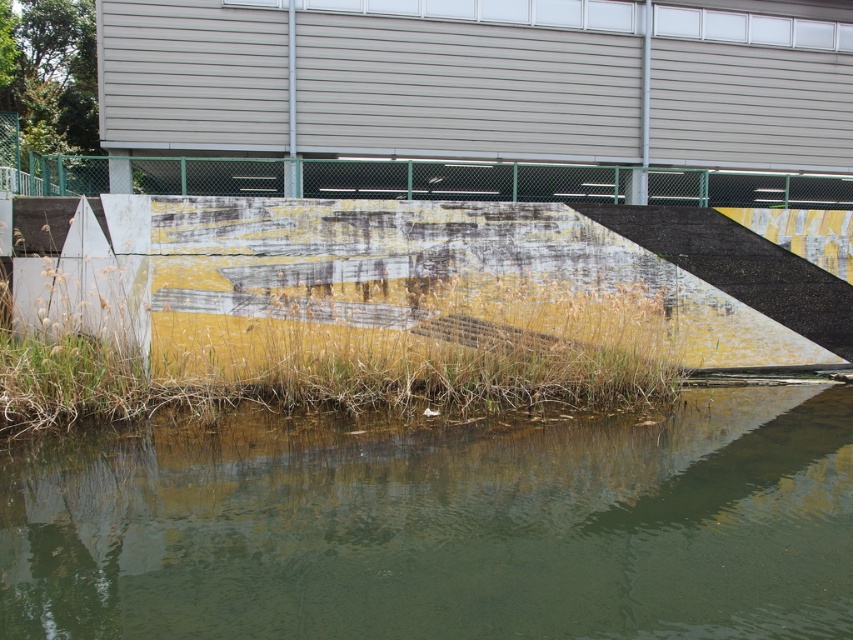
Between green matte water at lower center and green chain-link fence at upper center, which one appears on the left side from the viewer's perspective?

green chain-link fence at upper center

Between green matte water at lower center and green chain-link fence at upper center, which one appears on the right side from the viewer's perspective?

green matte water at lower center is more to the right.

This screenshot has height=640, width=853. What do you see at coordinates (442, 528) in the screenshot? I see `green matte water at lower center` at bounding box center [442, 528].

Locate an element on the screen. The height and width of the screenshot is (640, 853). green matte water at lower center is located at coordinates (442, 528).